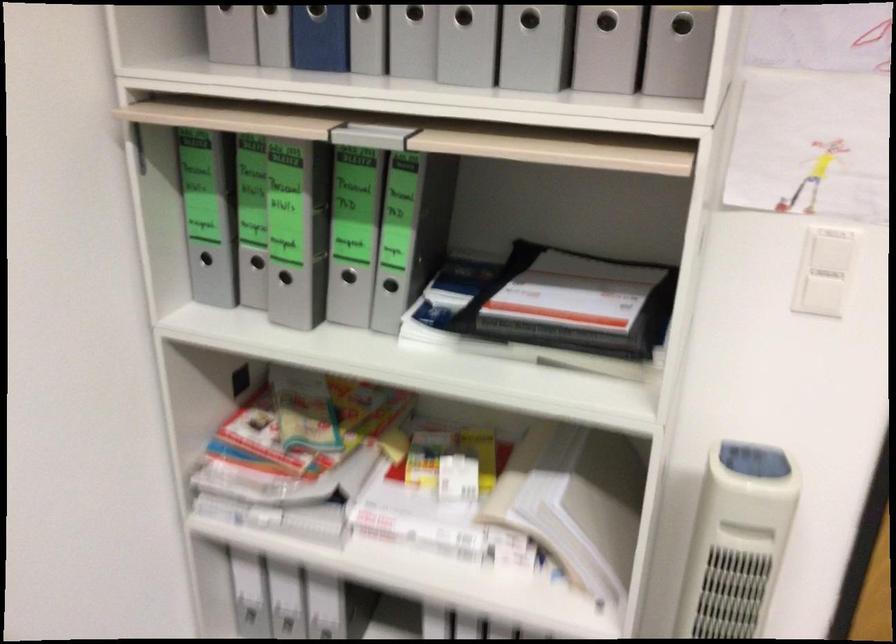
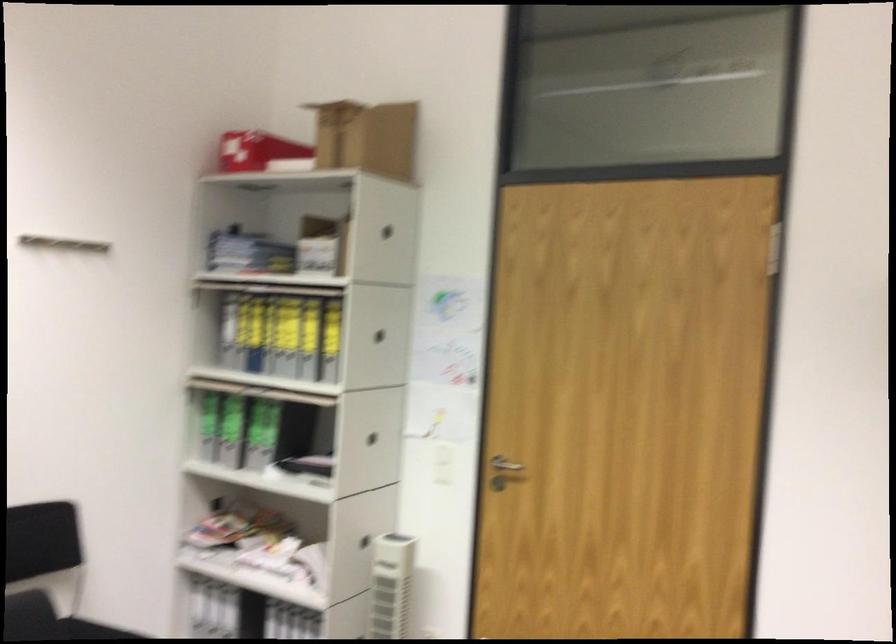
The point at [686,250] is marked in the first image. Where is the corresponding point in the second image?

(372, 438)